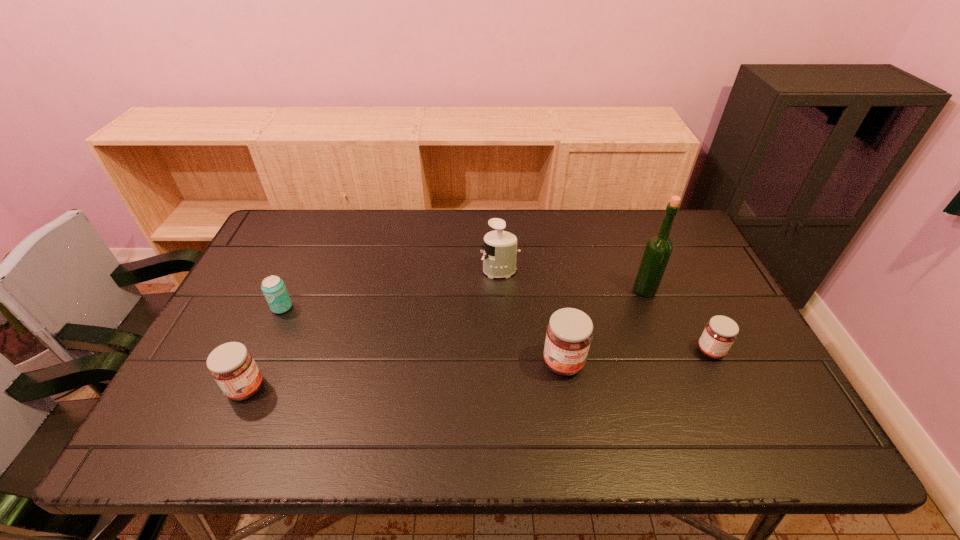
Image resolution: width=960 pixels, height=540 pixels. In order to click on free area in between the shortest jam and the juicer in this screenshot , I will do click(605, 311).

In order to click on free point between the fifth shortest object and the second tallest jam in this screenshot , I will do `click(373, 329)`.

Where is `free space between the leftmost jam and the fifth object from left to right`? free space between the leftmost jam and the fifth object from left to right is located at coordinates (445, 339).

Where is `free space between the third shortest object and the liquor`? free space between the third shortest object and the liquor is located at coordinates (445, 339).

Where is `free space between the second tallest jam and the tallest jam`? free space between the second tallest jam and the tallest jam is located at coordinates (405, 375).

This screenshot has height=540, width=960. In order to click on empty space that is in between the beer can and the fourth shortest object in this screenshot , I will do `click(422, 335)`.

Where is `vacant area between the beer can and the leftmost jam`? The height and width of the screenshot is (540, 960). vacant area between the beer can and the leftmost jam is located at coordinates (264, 348).

In order to click on free space that is in between the third shortest object and the rightmost jam in this screenshot , I will do `click(478, 369)`.

Image resolution: width=960 pixels, height=540 pixels. I want to click on the closest object to the juicer, so click(569, 334).

Identify which object is the second closest to the fourth nearest object. Please provide its 2D coordinates. Your answer should be formatted as a tuple, i.e. [(x, y)], where the tuple contains the x and y coordinates of a point satisfying the conditions above.

[(499, 257)]